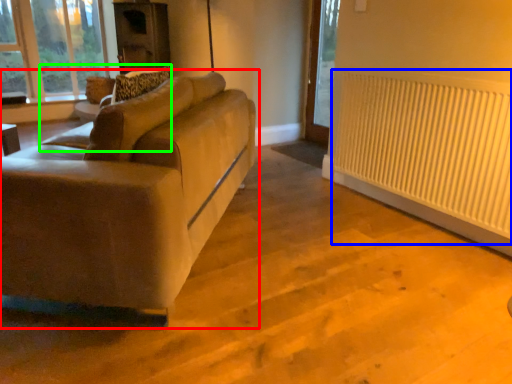
Question: Based on their relative distances, which object is farther from studio couch (highlighted by a red box)? Choose from radiator (highlighted by a blue box) and swivel chair (highlighted by a green box).

Choices:
 (A) radiator
 (B) swivel chair

Answer: (A)